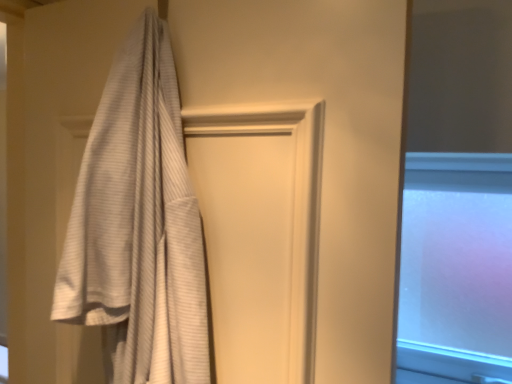
What do you see at coordinates (138, 225) in the screenshot?
I see `white striped fabric at left` at bounding box center [138, 225].

In order to face white striped fabric at left, should I rotate leftwards or rightwards?

You should rotate left by 17.292 degrees.

This screenshot has height=384, width=512. Find the location of `white striped fabric at left`. white striped fabric at left is located at coordinates (138, 225).

The image size is (512, 384). I want to click on white striped fabric at left, so click(x=138, y=225).